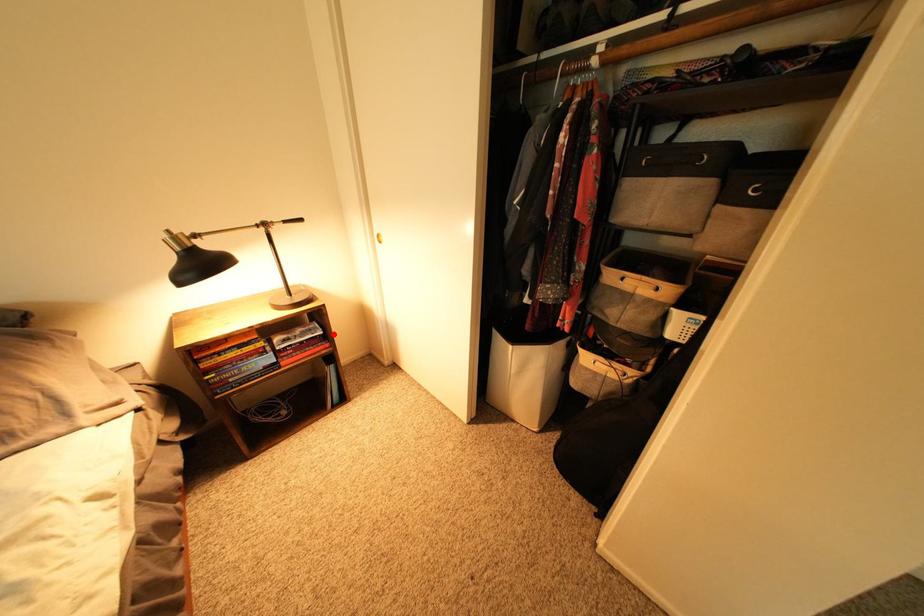
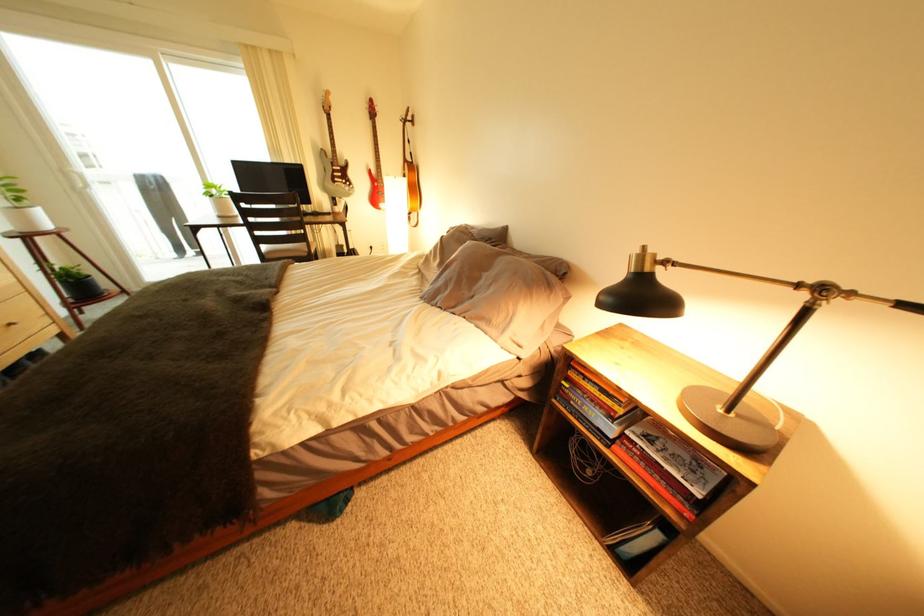
Find the pixel in the second image that matches the highlighted location in the first image.

(712, 496)